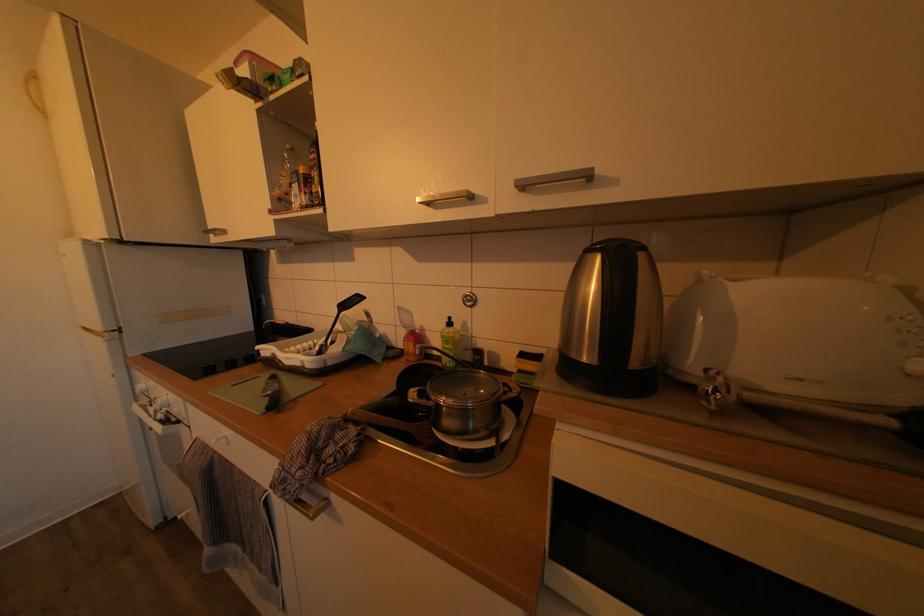
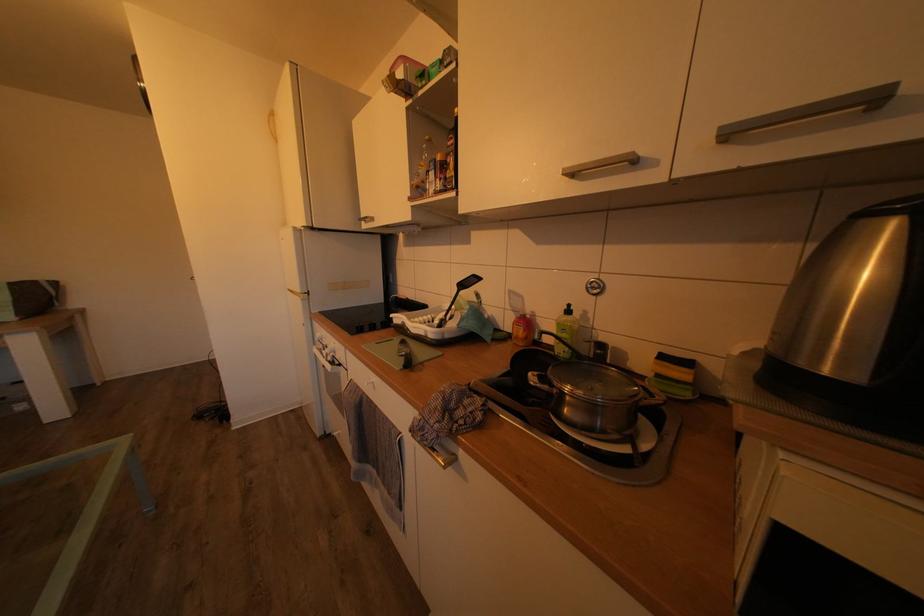
The point at (x=480, y=342) is marked in the first image. Where is the corresponding point in the second image?

(601, 334)